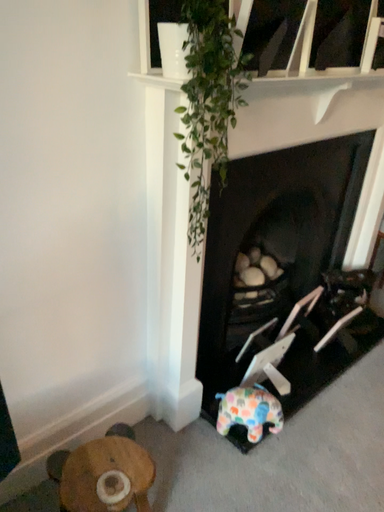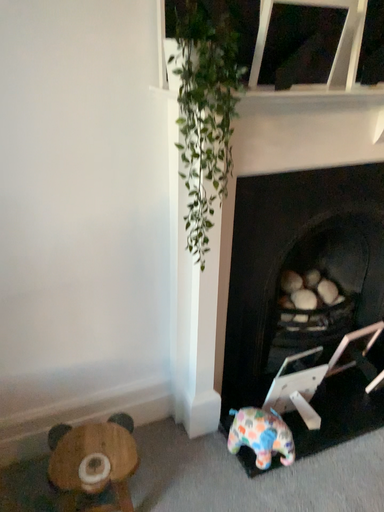
Question: How did the camera likely rotate when shooting the video?

Choices:
 (A) rotated right
 (B) rotated left

Answer: (B)